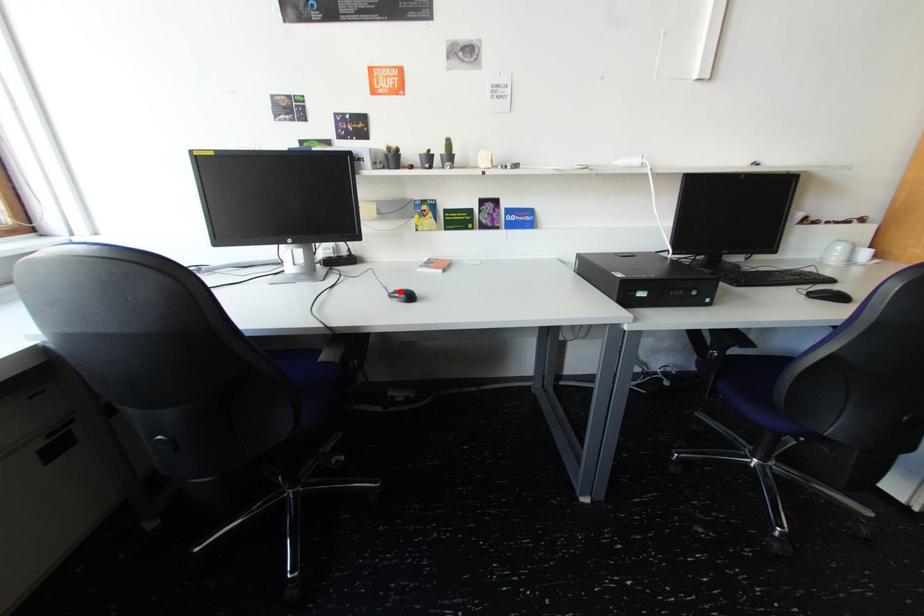
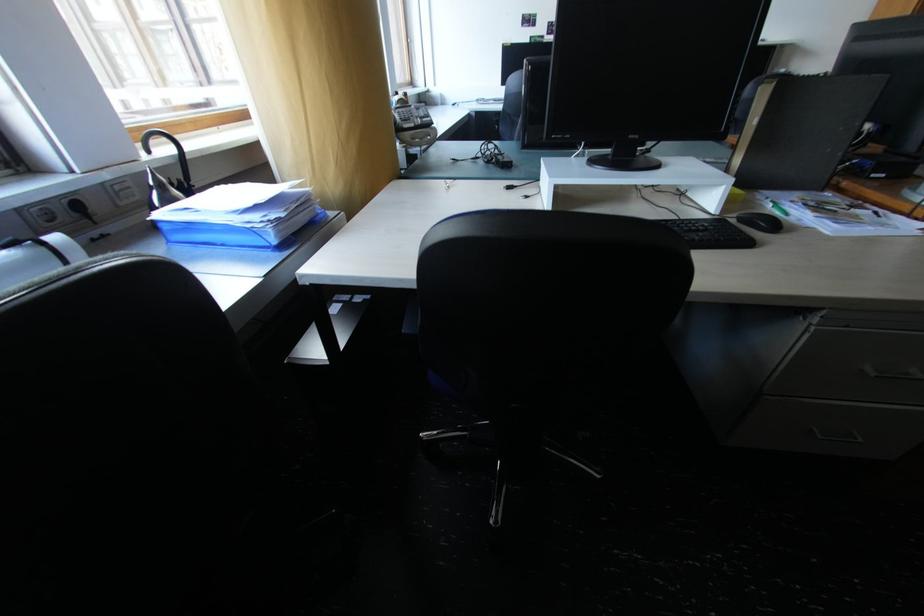
Question: I am providing you with two images of the same scene from different viewpoints. A red point is marked on the first image. Is the red point's position out of view in image 2?

Choices:
 (A) Yes
 (B) No

Answer: (A)